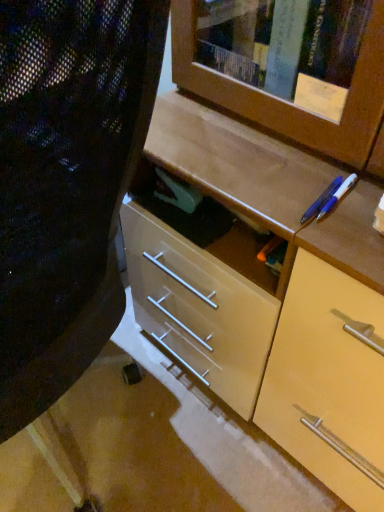
Question: Is the surface of blue plastic pen at upper right, which is the 2th pencil in left-to-right order, in direct contact with matte black folding chair at center?

Choices:
 (A) no
 (B) yes

Answer: (A)

Question: From a real-world perspective, is blue plastic pen at upper right, the first pencil in the right-to-left sequence, below matte black folding chair at center?

Choices:
 (A) yes
 (B) no

Answer: (B)

Question: Is the position of blue plastic pen at upper right, the first pencil in the right-to-left sequence, less distant than that of matte black folding chair at center?

Choices:
 (A) no
 (B) yes

Answer: (A)

Question: Does blue plastic pen at upper right, which is the 2th pencil in left-to-right order, have a lesser height compared to matte black folding chair at center?

Choices:
 (A) yes
 (B) no

Answer: (A)

Question: Would you say blue plastic pen at upper right, which is the 2th pencil in left-to-right order, is outside matte black folding chair at center?

Choices:
 (A) yes
 (B) no

Answer: (A)

Question: In terms of size, does matte black folding chair at center appear bigger or smaller than blue glossy pen at upper right, placed as the 1th pencil when sorted from left to right?

Choices:
 (A) small
 (B) big

Answer: (B)

Question: From the image's perspective, is matte black folding chair at center above or below blue glossy pen at upper right, placed as the 1th pencil when sorted from left to right?

Choices:
 (A) above
 (B) below

Answer: (B)

Question: Is matte black folding chair at center wider or thinner than blue glossy pen at upper right, placed as the 1th pencil when sorted from left to right?

Choices:
 (A) wide
 (B) thin

Answer: (A)

Question: Do you think matte black folding chair at center is within blue glossy pen at upper right, which is the second pencil from right to left, or outside of it?

Choices:
 (A) outside
 (B) inside

Answer: (A)

Question: Is blue plastic pen at upper right, the first pencil in the right-to-left sequence, inside or outside of matte black folding chair at center?

Choices:
 (A) outside
 (B) inside

Answer: (A)

Question: From their relative heights in the image, would you say blue plastic pen at upper right, the first pencil in the right-to-left sequence, is taller or shorter than matte black folding chair at center?

Choices:
 (A) short
 (B) tall

Answer: (A)

Question: Is point (321, 215) positioned closer to the camera than point (46, 192)?

Choices:
 (A) farther
 (B) closer

Answer: (A)

Question: From a real-world perspective, is blue plastic pen at upper right, the first pencil in the right-to-left sequence, physically located above or below matte black folding chair at center?

Choices:
 (A) above
 (B) below

Answer: (A)

Question: In the image, is matte black folding chair at center positioned in front of or behind blue plastic pen at upper right, the first pencil in the right-to-left sequence?

Choices:
 (A) behind
 (B) front

Answer: (B)

Question: Choose the correct answer: Is matte black folding chair at center inside blue plastic pen at upper right, which is the 2th pencil in left-to-right order, or outside it?

Choices:
 (A) outside
 (B) inside

Answer: (A)